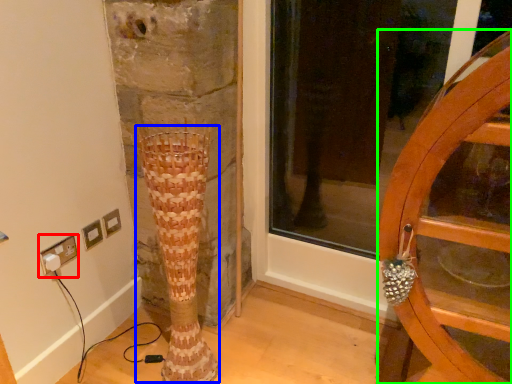
Question: Estimate the real-world distances between objects in this image. Which object is closer to electric outlet (highlighted by a red box), tree trunk (highlighted by a blue box) or furniture (highlighted by a green box)?

Choices:
 (A) tree trunk
 (B) furniture

Answer: (A)